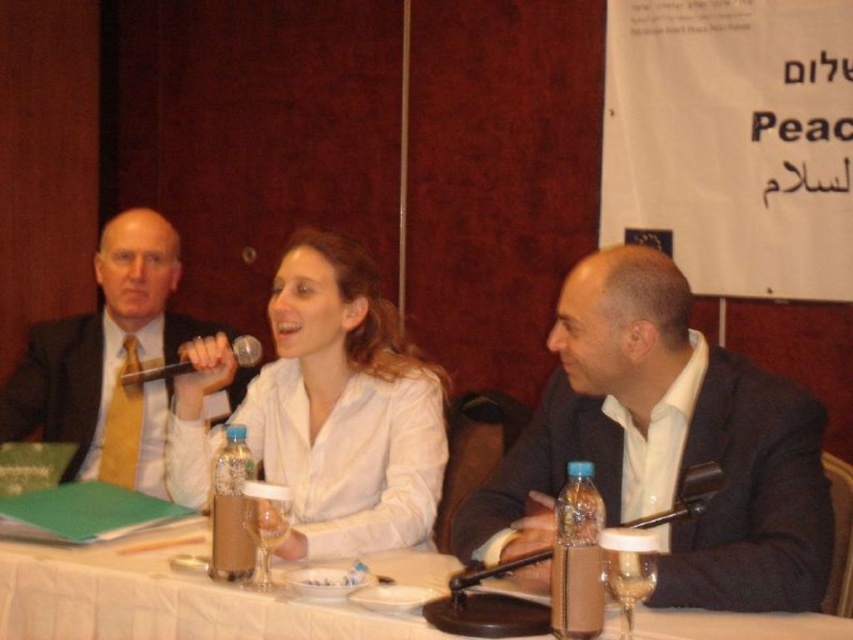
Is matte black jacket at center in front of black plastic microphone at lower right?

No, matte black jacket at center is behind black plastic microphone at lower right.

Can you confirm if matte black jacket at center is thinner than black plastic microphone at lower right?

No, matte black jacket at center is not thinner than black plastic microphone at lower right.

I want to click on matte black jacket at center, so 666,445.

Can you confirm if matte black jacket at center is positioned above white matte shirt at center?

Incorrect, matte black jacket at center is not positioned above white matte shirt at center.

Between point (521, 465) and point (410, 497), which one is positioned behind?

The point (410, 497) is behind.

The height and width of the screenshot is (640, 853). Find the location of `matte black jacket at center`. matte black jacket at center is located at coordinates (666, 445).

Can you confirm if white matte shirt at center is shorter than matte black suit at left?

Indeed, white matte shirt at center has a lesser height compared to matte black suit at left.

Can you confirm if white matte shirt at center is positioned above matte black suit at left?

No, white matte shirt at center is not above matte black suit at left.

Which is behind, point (180, 380) or point (109, 460)?

Point (109, 460)

Locate an element on the screen. white matte shirt at center is located at coordinates (344, 406).